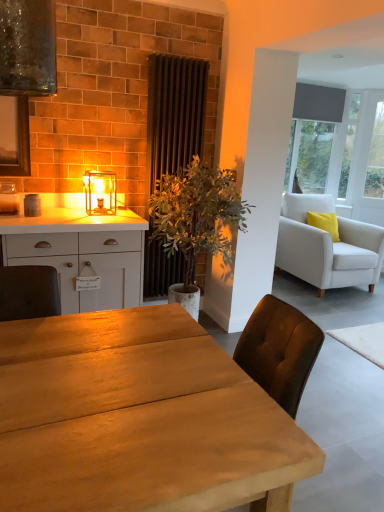
Question: Based on their positions, is dark brown fabric radiator at center located to the left or right of matte glass lantern at center?

Choices:
 (A) left
 (B) right

Answer: (B)

Question: Relative to matte glass lantern at center, is dark brown fabric radiator at center in front or behind?

Choices:
 (A) front
 (B) behind

Answer: (B)

Question: Estimate the real-world distances between objects in this image. Which object is closer to the wooden table at center?

Choices:
 (A) green leafy plant at center
 (B) transparent glass door at upper right
 (C) white fabric armchair at right
 (D) matte gray shade at upper right
 (E) white matte cabinet at left

Answer: (E)

Question: Estimate the real-world distances between objects in this image. Which object is closer to the white matte cabinet at left?

Choices:
 (A) transparent glass door at upper right
 (B) wooden table at center
 (C) white fabric armchair at right
 (D) dark brown fabric radiator at center
 (E) green leafy plant at center

Answer: (E)